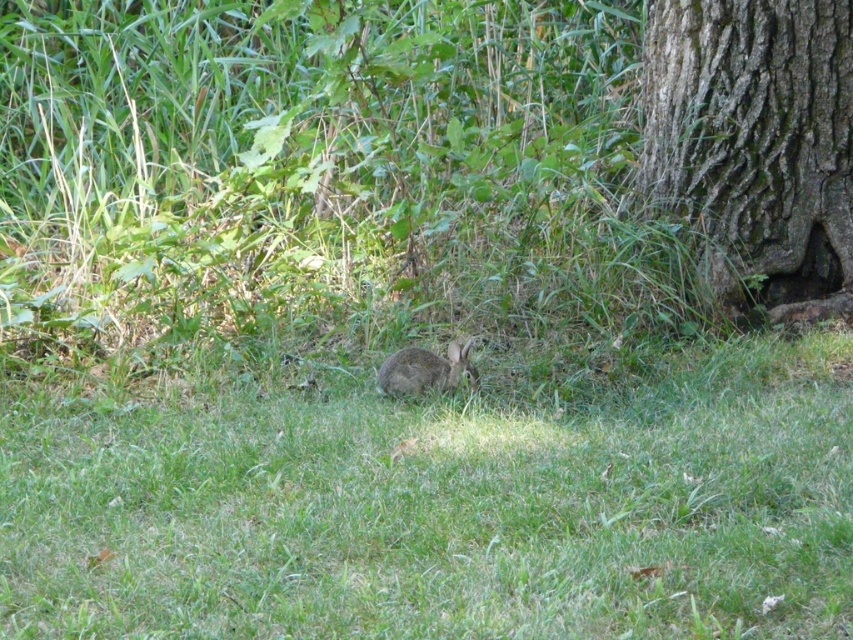
Which is below, gray textured bark at lower right or fuzzy brown rabbit at center?

fuzzy brown rabbit at center is below.

Does gray textured bark at lower right have a lesser width compared to fuzzy brown rabbit at center?

Incorrect, gray textured bark at lower right's width is not less than fuzzy brown rabbit at center's.

What do you see at coordinates (756, 141) in the screenshot?
I see `gray textured bark at lower right` at bounding box center [756, 141].

Identify the location of gray textured bark at lower right. (756, 141).